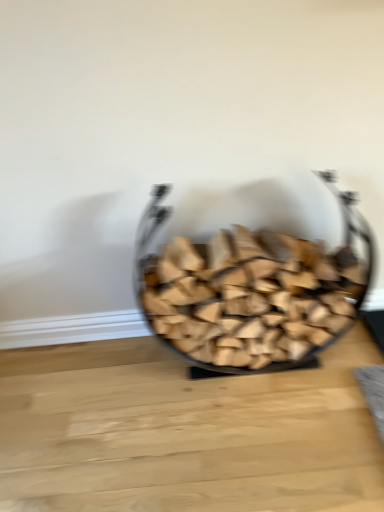
What are the coordinates of `vacant space in front of wooden logs at center` in the screenshot? It's located at (266, 445).